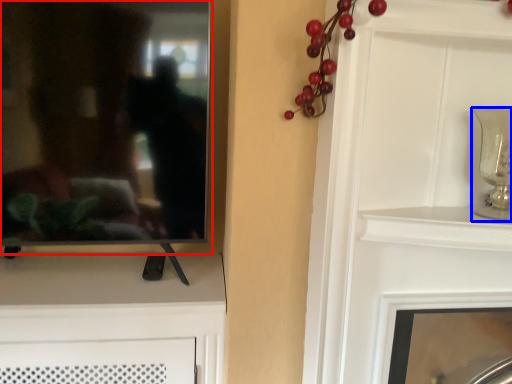
Question: Which object appears closest to the camera in this image, mirror (highlighted by a red box) or candle holder (highlighted by a blue box)?

Choices:
 (A) mirror
 (B) candle holder

Answer: (B)